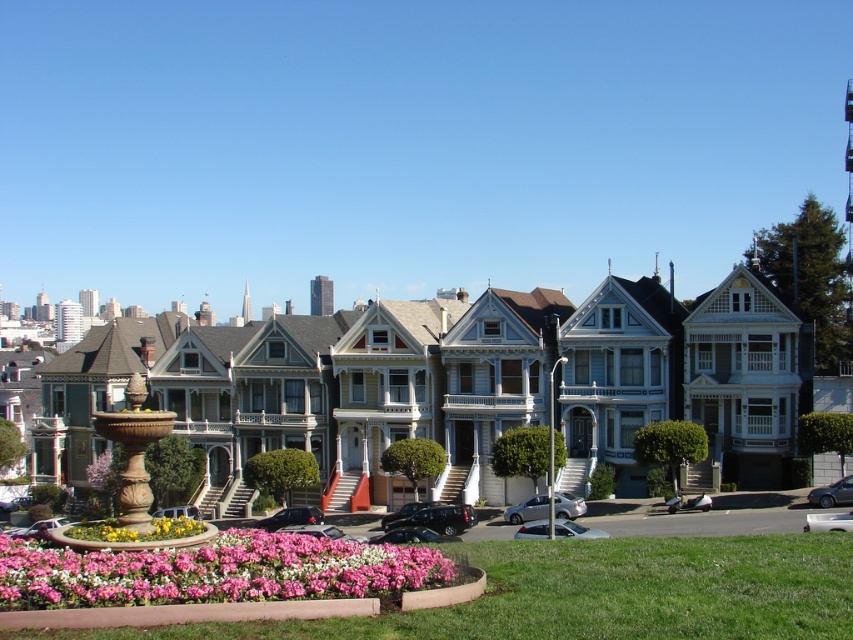
Question: Can you confirm if pink floral bed at lower center is positioned above floral mosaic at center?

Choices:
 (A) no
 (B) yes

Answer: (A)

Question: Observing the image, what is the correct spatial positioning of pink floral bed at lower center in reference to marble fountain at center left?

Choices:
 (A) left
 (B) right

Answer: (B)

Question: Which object is closer to the camera taking this photo?

Choices:
 (A) pink floral bed at lower center
 (B) floral mosaic at center

Answer: (A)

Question: Which of these objects is positioned closest to the pink floral bed at lower center?

Choices:
 (A) floral mosaic at center
 (B) marble fountain at center left

Answer: (A)

Question: Is pink floral bed at lower center behind floral mosaic at center?

Choices:
 (A) yes
 (B) no

Answer: (B)

Question: Considering the real-world distances, which object is closest to the floral mosaic at center?

Choices:
 (A) marble fountain at center left
 (B) pink floral bed at lower center

Answer: (B)